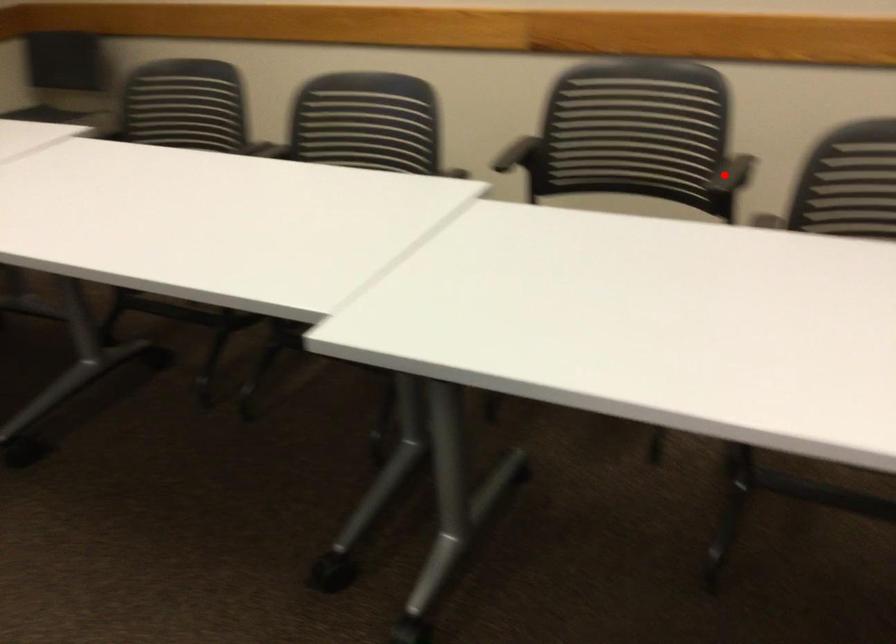
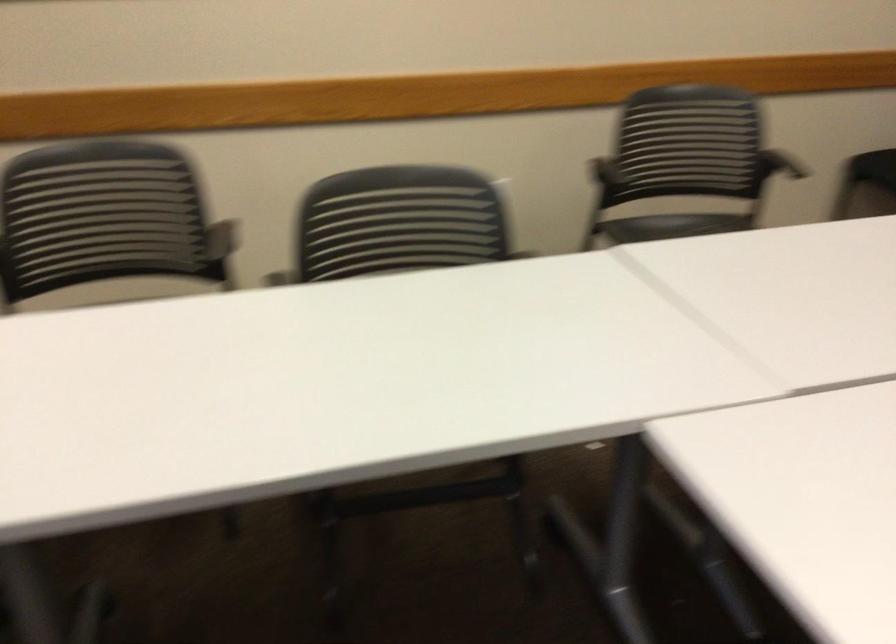
Locate, in the second image, the point that corresponds to the highlighted location in the first image.

(211, 242)